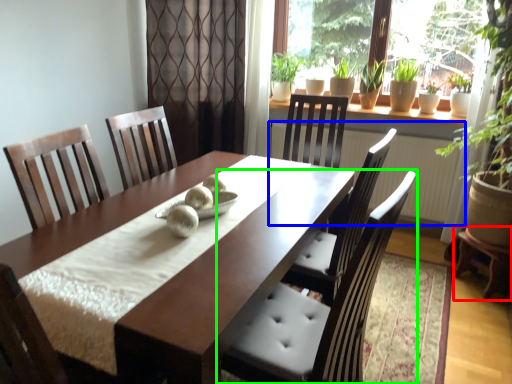
Question: Estimate the real-world distances between objects in this image. Which object is farther from table (highlighted by a red box), radiator (highlighted by a blue box) or chair (highlighted by a green box)?

Choices:
 (A) radiator
 (B) chair

Answer: (B)